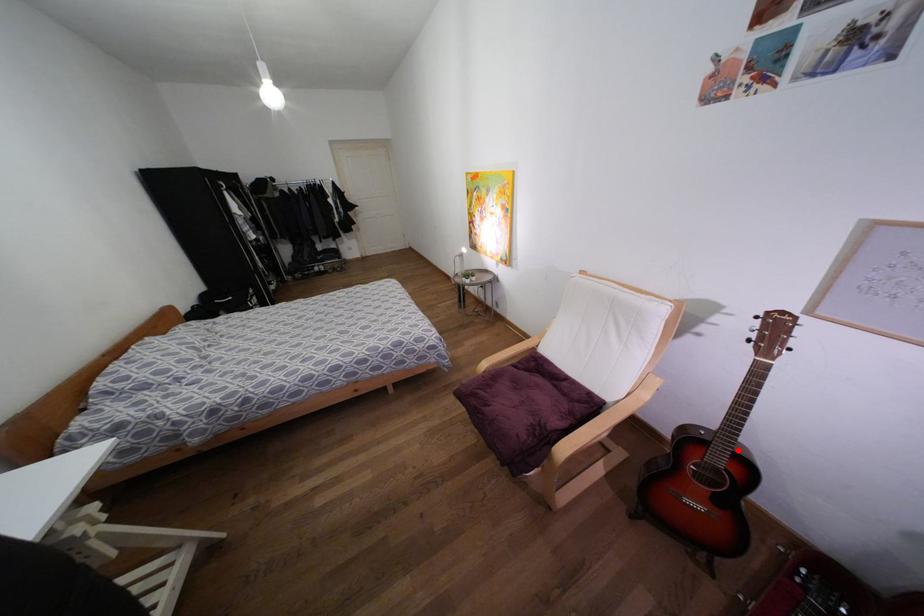
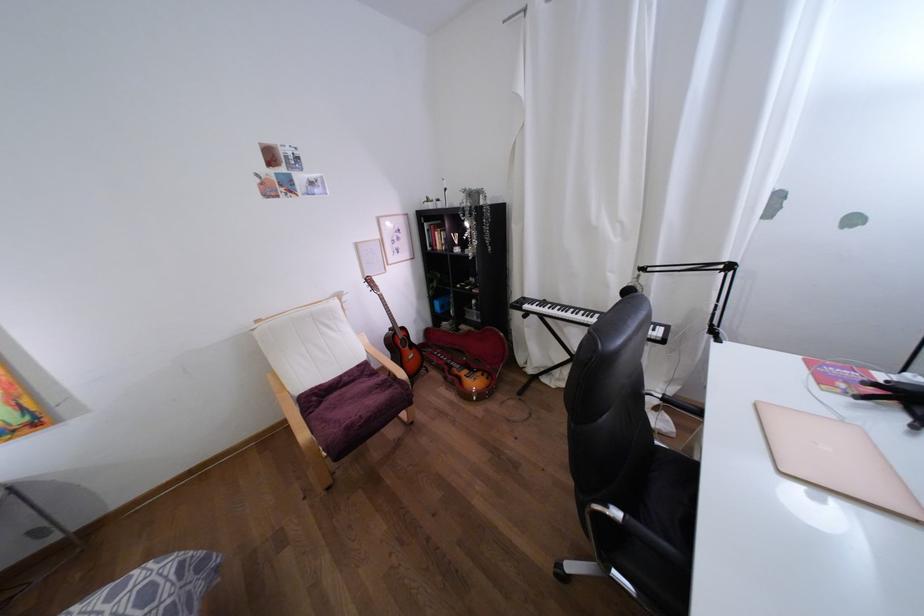
Find the pixel in the second image that matches the highlighted location in the first image.

(398, 325)